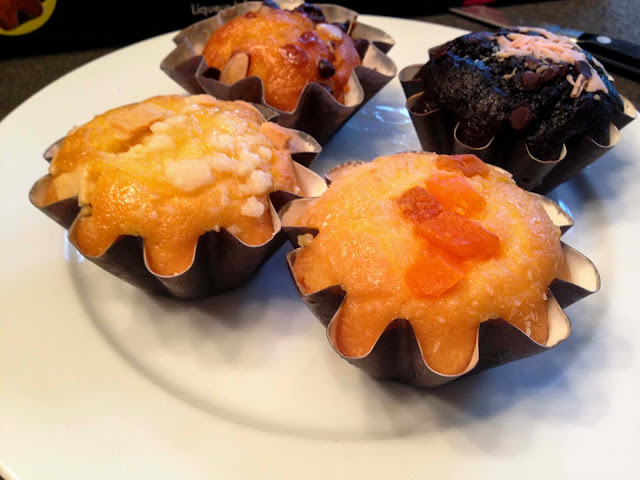
You are a GUI agent. You are given a task and a screenshot of the screen. Output one action in this format:
    pyautogui.click(x=<x>, y=<y>)
    Task: Click on the knife handle
    
    Given the screenshot: What is the action you would take?
    pyautogui.click(x=628, y=58)